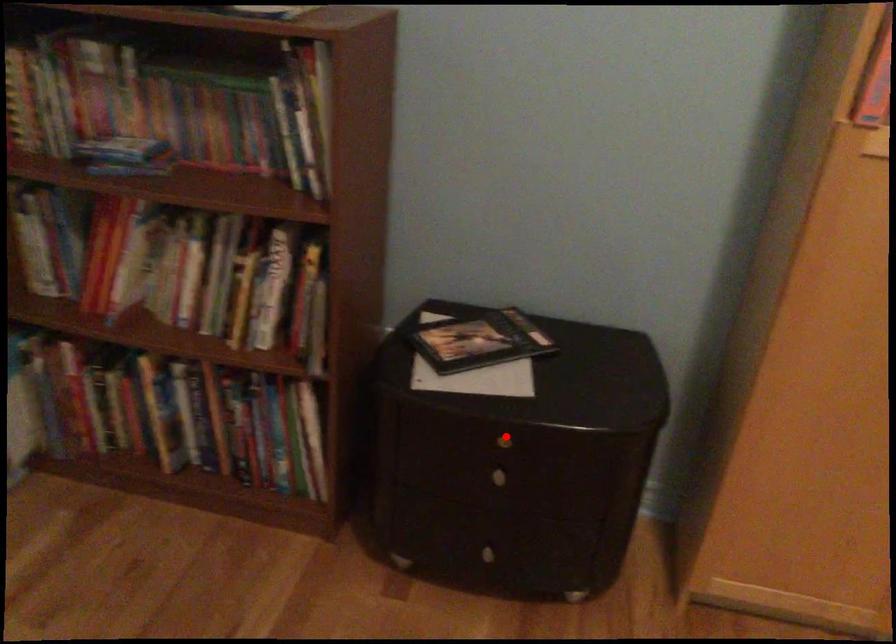
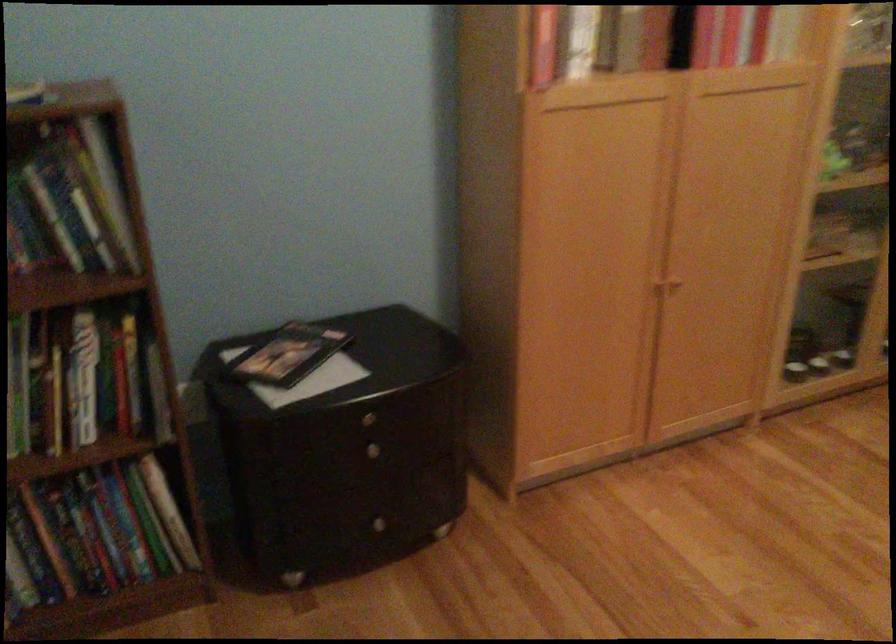
Locate, in the second image, the point that corresponds to the highlighted location in the first image.

(367, 415)